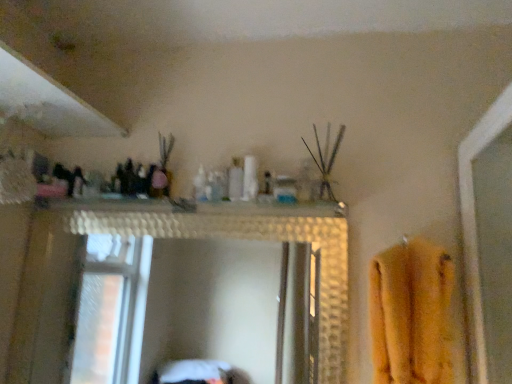
What do you see at coordinates (200, 185) in the screenshot?
I see `translucent plastic bottle at center` at bounding box center [200, 185].

This screenshot has width=512, height=384. I want to click on white glossy shelf at upper center, so click(198, 207).

Do you think translucent plastic bottle at center is within white glossy shelf at upper center, or outside of it?

translucent plastic bottle at center is spatially situated outside white glossy shelf at upper center.

How far apart are translucent plastic bottle at center and white glossy shelf at upper center?

A distance of 8.04 inches exists between translucent plastic bottle at center and white glossy shelf at upper center.

Is translucent plastic bottle at center far away from white glossy shelf at upper center?

No, translucent plastic bottle at center is not far away from white glossy shelf at upper center.

From the picture: Is translucent plastic bottle at center oriented away from white glossy shelf at upper center?

No, translucent plastic bottle at center is not facing the opposite direction of white glossy shelf at upper center.

Considering the sizes of objects white glossy shelf at upper center and translucent plastic bottle at center in the image provided, who is thinner, white glossy shelf at upper center or translucent plastic bottle at center?

With smaller width is translucent plastic bottle at center.

Is white glossy shelf at upper center not inside translucent plastic bottle at center?

Yes, white glossy shelf at upper center is located beyond the bounds of translucent plastic bottle at center.

From a real-world perspective, is white glossy shelf at upper center physically below translucent plastic bottle at center?

Yes, from a real-world perspective, white glossy shelf at upper center is under translucent plastic bottle at center.

Between yellow fuzzy bath towel at right and white glossy shelf at upper center, which one is positioned in front?

yellow fuzzy bath towel at right is in front.

Is point (426, 374) less distant than point (112, 199)?

Yes, it is in front of point (112, 199).

From a real-world perspective, who is located lower, yellow fuzzy bath towel at right or white glossy shelf at upper center?

yellow fuzzy bath towel at right, from a real-world perspective.

Looking at the image, does yellow fuzzy bath towel at right seem bigger or smaller compared to translucent plastic bottle at center?

In the image, yellow fuzzy bath towel at right appears to be larger than translucent plastic bottle at center.

Is point (429, 292) positioned before point (204, 178)?

That is True.

How different are the orientations of yellow fuzzy bath towel at right and translucent plastic bottle at center in degrees?

yellow fuzzy bath towel at right and translucent plastic bottle at center are facing 9.96 degrees away from each other.

Considering the positions of objects yellow fuzzy bath towel at right and translucent plastic bottle at center in the image provided, who is more to the right, yellow fuzzy bath towel at right or translucent plastic bottle at center?

Positioned to the right is yellow fuzzy bath towel at right.

Which is farther from the camera, (199,200) or (434,333)?

Point (199,200)

From a real-world perspective, is translucent plastic bottle at center below yellow fuzzy bath towel at right?

No, from a real-world perspective, translucent plastic bottle at center is not under yellow fuzzy bath towel at right.

In the scene shown: Is translucent plastic bottle at center looking in the opposite direction of yellow fuzzy bath towel at right?

No, translucent plastic bottle at center is not facing the opposite direction of yellow fuzzy bath towel at right.

From their relative heights in the image, would you say translucent plastic bottle at center is taller or shorter than yellow fuzzy bath towel at right?

translucent plastic bottle at center is shorter than yellow fuzzy bath towel at right.

Is the depth of white glossy shelf at upper center greater than that of yellow fuzzy bath towel at right?

Yes, white glossy shelf at upper center is behind yellow fuzzy bath towel at right.

Does white glossy shelf at upper center turn towards yellow fuzzy bath towel at right?

No, white glossy shelf at upper center is not aimed at yellow fuzzy bath towel at right.

From a real-world perspective, is white glossy shelf at upper center positioned above or below yellow fuzzy bath towel at right?

white glossy shelf at upper center is above yellow fuzzy bath towel at right.

Image resolution: width=512 pixels, height=384 pixels. Find the location of `toiletry on the right of white glossy shelf at upper center`. toiletry on the right of white glossy shelf at upper center is located at coordinates (200, 185).

Where is `toiletry behind the white glossy shelf at upper center`? toiletry behind the white glossy shelf at upper center is located at coordinates (200, 185).

Considering their positions, is translucent plastic bottle at center positioned further to white glossy shelf at upper center than yellow fuzzy bath towel at right?

yellow fuzzy bath towel at right is further to white glossy shelf at upper center.

Which object lies further to the anchor point yellow fuzzy bath towel at right, white glossy shelf at upper center or translucent plastic bottle at center?

translucent plastic bottle at center.

Based on the photo, from the image, which object appears to be farther from yellow fuzzy bath towel at right, translucent plastic bottle at center or white glossy shelf at upper center?

Among the two, translucent plastic bottle at center is located further to yellow fuzzy bath towel at right.

When comparing their distances from translucent plastic bottle at center, does yellow fuzzy bath towel at right or white glossy shelf at upper center seem further?

The object further to translucent plastic bottle at center is yellow fuzzy bath towel at right.

From the picture: When comparing their distances from white glossy shelf at upper center, does yellow fuzzy bath towel at right or translucent plastic bottle at center seem further?

yellow fuzzy bath towel at right is positioned further to the anchor white glossy shelf at upper center.

When comparing their distances from translucent plastic bottle at center, does white glossy shelf at upper center or yellow fuzzy bath towel at right seem further?

Among the two, yellow fuzzy bath towel at right is located further to translucent plastic bottle at center.

You are a GUI agent. You are given a task and a screenshot of the screen. Output one action in this format:
    pyautogui.click(x=<x>, y=<y>)
    Task: Click on the toiletry between white glossy shelf at upper center and yellow fuzzy bath towel at right
    The height and width of the screenshot is (384, 512).
    Given the screenshot: What is the action you would take?
    pyautogui.click(x=200, y=185)